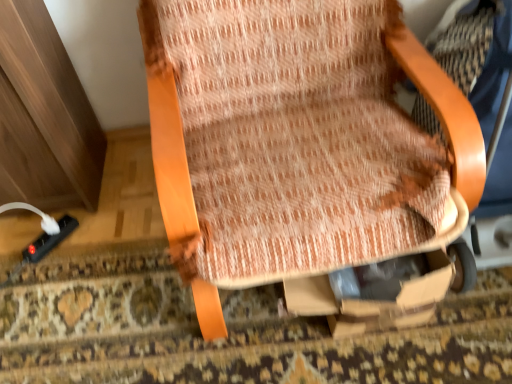
The width and height of the screenshot is (512, 384). Describe the element at coordinates (49, 240) in the screenshot. I see `black plastic plug at lower left` at that location.

I want to click on black plastic plug at lower left, so (x=49, y=240).

Measure the distance between point (x=58, y=239) and camera.

The depth of point (x=58, y=239) is 4.33 feet.

The height and width of the screenshot is (384, 512). What do you see at coordinates (298, 144) in the screenshot?
I see `textured fabric chair at center` at bounding box center [298, 144].

You are a GUI agent. You are given a task and a screenshot of the screen. Output one action in this format:
    pyautogui.click(x=<x>, y=<y>)
    Task: Click on the textured fabric chair at center
    
    Given the screenshot: What is the action you would take?
    pyautogui.click(x=298, y=144)

I want to click on black plastic plug at lower left, so click(49, 240).

Does textured fabric chair at center appear on the right side of black plastic plug at lower left?

Correct, you'll find textured fabric chair at center to the right of black plastic plug at lower left.

Considering the relative positions of textured fabric chair at center and black plastic plug at lower left in the image provided, is textured fabric chair at center in front of black plastic plug at lower left?

Yes, it is in front of black plastic plug at lower left.

Is point (461, 160) farther from viewer compared to point (47, 251)?

No, it is not.

From the image's perspective, is textured fabric chair at center beneath black plastic plug at lower left?

Actually, textured fabric chair at center appears above black plastic plug at lower left in the image.

From a real-world perspective, between textured fabric chair at center and black plastic plug at lower left, who is vertically higher?

textured fabric chair at center is physically above.

Can you confirm if textured fabric chair at center is wider than black plastic plug at lower left?

Yes.

Who is taller, textured fabric chair at center or black plastic plug at lower left?

With more height is textured fabric chair at center.

Considering the sizes of objects textured fabric chair at center and black plastic plug at lower left in the image provided, who is bigger, textured fabric chair at center or black plastic plug at lower left?

textured fabric chair at center is bigger.

Do you think textured fabric chair at center is within black plastic plug at lower left, or outside of it?

textured fabric chair at center exists outside the volume of black plastic plug at lower left.

Does textured fabric chair at center touch black plastic plug at lower left?

No, textured fabric chair at center is not beside black plastic plug at lower left.

Is textured fabric chair at center turned away from black plastic plug at lower left?

No, black plastic plug at lower left is not at the back of textured fabric chair at center.

In the scene shown: How far apart are textured fabric chair at center and black plastic plug at lower left?

They are 82.04 centimeters apart.

The width and height of the screenshot is (512, 384). What are the coordinates of `plug located behind the textured fabric chair at center` in the screenshot? It's located at (49, 240).

Between black plastic plug at lower left and textured fabric chair at center, which one appears on the right side from the viewer's perspective?

textured fabric chair at center.

Relative to textured fabric chair at center, is black plastic plug at lower left in front or behind?

black plastic plug at lower left is behind textured fabric chair at center.

Is point (39, 257) closer or farther from the camera than point (242, 143)?

Point (39, 257) is positioned farther from the camera compared to point (242, 143).

From the image's perspective, which is above, black plastic plug at lower left or textured fabric chair at center?

From the image's view, textured fabric chair at center is above.

From a real-world perspective, does black plastic plug at lower left stand above textured fabric chair at center?

No, from a real-world perspective, black plastic plug at lower left is not on top of textured fabric chair at center.

Can you confirm if black plastic plug at lower left is thinner than textured fabric chair at center?

Indeed, black plastic plug at lower left has a lesser width compared to textured fabric chair at center.

Who is taller, black plastic plug at lower left or textured fabric chair at center?

textured fabric chair at center.

Based on their sizes in the image, would you say black plastic plug at lower left is bigger or smaller than textured fabric chair at center?

In the image, black plastic plug at lower left appears to be smaller than textured fabric chair at center.

Can we say black plastic plug at lower left lies outside textured fabric chair at center?

black plastic plug at lower left lies outside textured fabric chair at center's area.

Is black plastic plug at lower left far away from textured fabric chair at center?

They are positioned close to each other.

Is black plastic plug at lower left oriented towards textured fabric chair at center?

No, black plastic plug at lower left is not facing towards textured fabric chair at center.

How many degrees apart are the facing directions of black plastic plug at lower left and textured fabric chair at center?

black plastic plug at lower left and textured fabric chair at center are facing 42.7 degrees away from each other.

Find the location of a particular element. The height and width of the screenshot is (384, 512). chair above the black plastic plug at lower left (from a real-world perspective) is located at coordinates (298, 144).

This screenshot has height=384, width=512. Identify the location of plug that is below the textured fabric chair at center (from the image's perspective). (49, 240).

The height and width of the screenshot is (384, 512). Identify the location of chair in front of the black plastic plug at lower left. (298, 144).